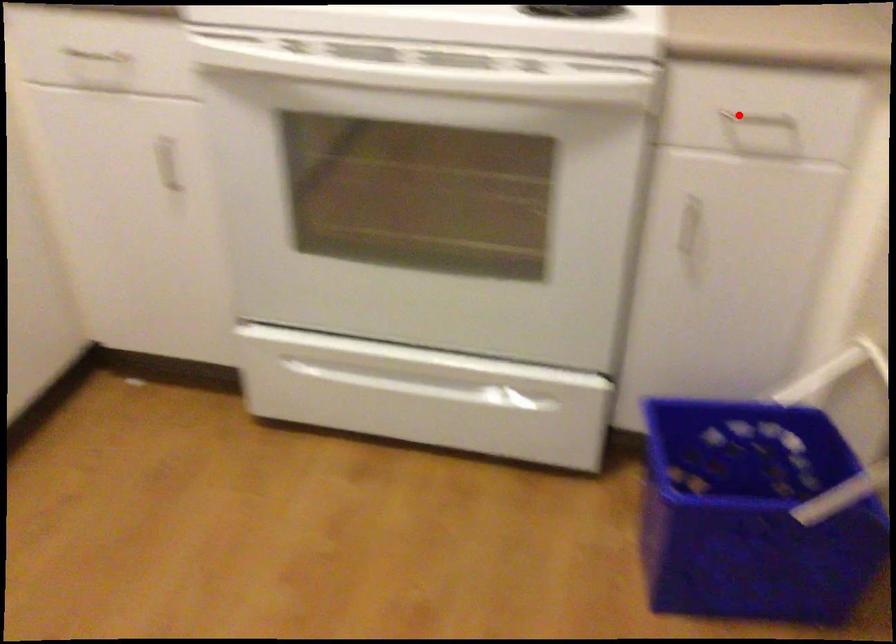
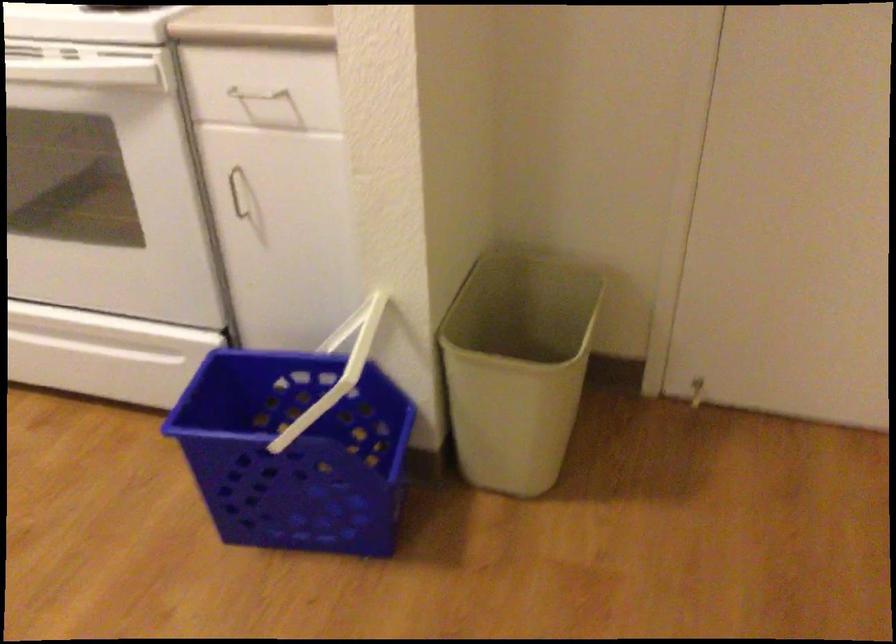
Find the pixel in the second image that matches the highlighted location in the first image.

(253, 98)